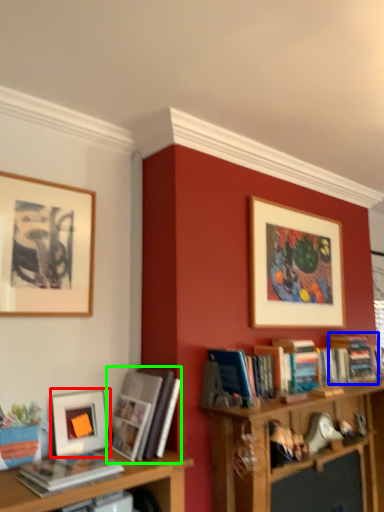
Question: Considering the real-world distances, which object is closest to picture frame (highlighted by a red box)? book (highlighted by a blue box) or book (highlighted by a green box).

Choices:
 (A) book
 (B) book

Answer: (B)